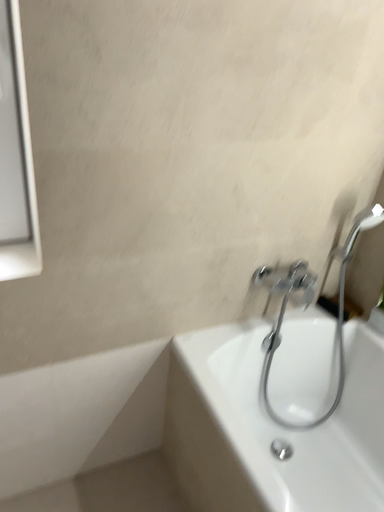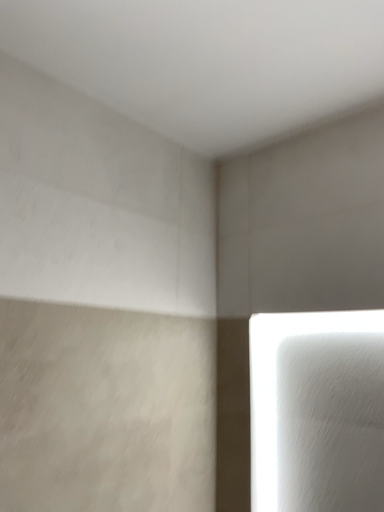
Question: How did the camera likely rotate when shooting the video?

Choices:
 (A) rotated right
 (B) rotated left

Answer: (A)